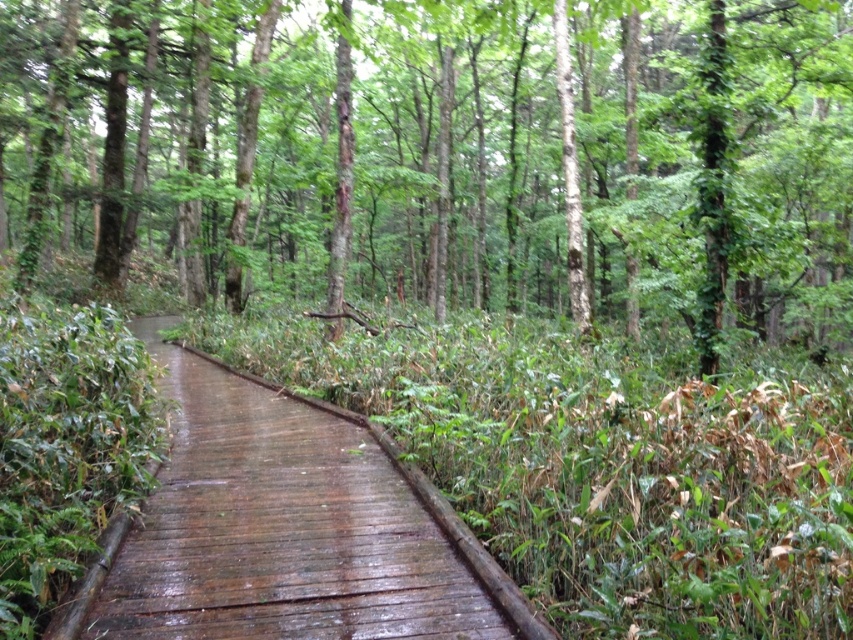
Is green matte tree at center shorter than wet wooden boardwalk at center?

No, green matte tree at center is not shorter than wet wooden boardwalk at center.

Who is lower down, green matte tree at center or wet wooden boardwalk at center?

wet wooden boardwalk at center is lower down.

Locate an element on the screen. The width and height of the screenshot is (853, 640). green matte tree at center is located at coordinates (453, 154).